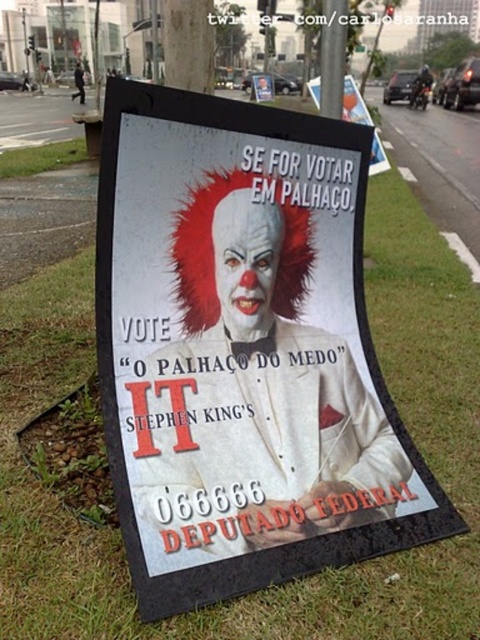
Question: Is metallic pole at upper center to the right of green grass at lower left from the viewer's perspective?

Choices:
 (A) no
 (B) yes

Answer: (B)

Question: Is white paper poster at center above metallic pole at upper center?

Choices:
 (A) yes
 (B) no

Answer: (B)

Question: Does white paper poster at center appear under green grass at lower left?

Choices:
 (A) no
 (B) yes

Answer: (B)

Question: Which of the following is the closest to the observer?

Choices:
 (A) (346, 104)
 (B) (215, 500)

Answer: (B)

Question: Which point is closer to the camera taking this photo?

Choices:
 (A) (373, 472)
 (B) (16, 177)
 (C) (323, 8)
 (D) (375, 132)

Answer: (A)

Question: Which of the following is the closest to the observer?

Choices:
 (A) metallic pole at upper center
 (B) white paper poster at center
 (C) green grass at lower left
 (D) matte plastic poster at upper center

Answer: (B)